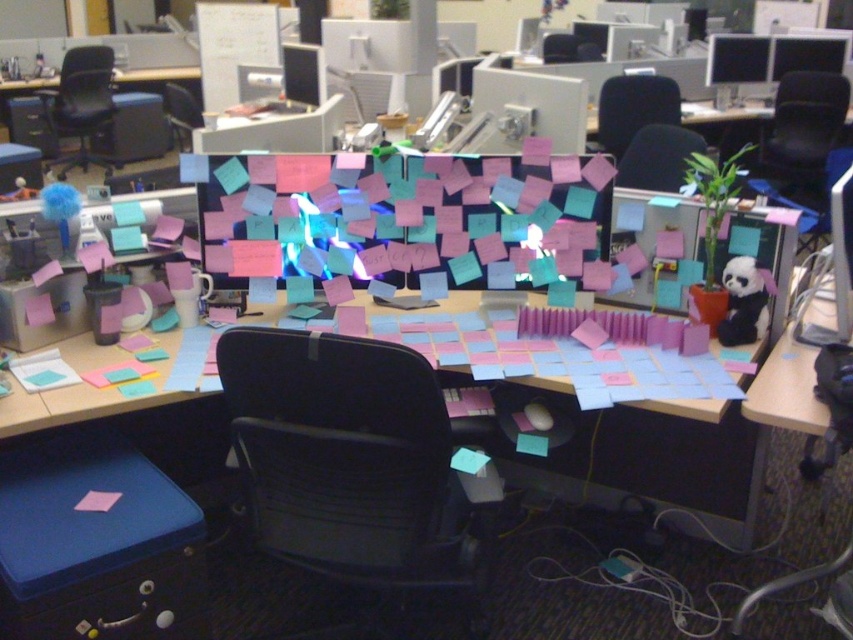
You are standing at the point marked by coordinates point (607, 221) and want to take a photo of the entire desk clutter with your camera. Based on the distance between the point and the camera, can you determine if the camera is close enough to capture the entire desk clutter in one shot?

The point point (607, 221) and camera are 6.97 feet apart. However, without knowing the camera sensor size, lens focal length, or field of view, it is impossible to determine if the camera is close enough to capture the entire desk clutter in one shot.

You are standing at the desk in the cluttered office workspace. You see two points marked on the desk surface. The first point is at coordinates point (366,196) and the second point is at coordinates point (613,140). Which point is closer to you as you face the desk?

Point (366,196) is in front of point (613,140), so it is closer to you as you face the desk.